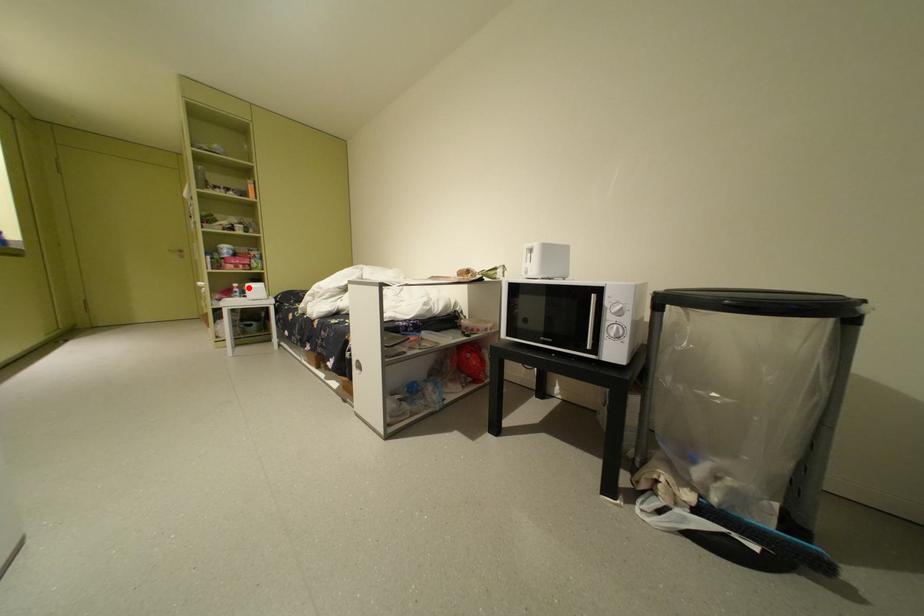
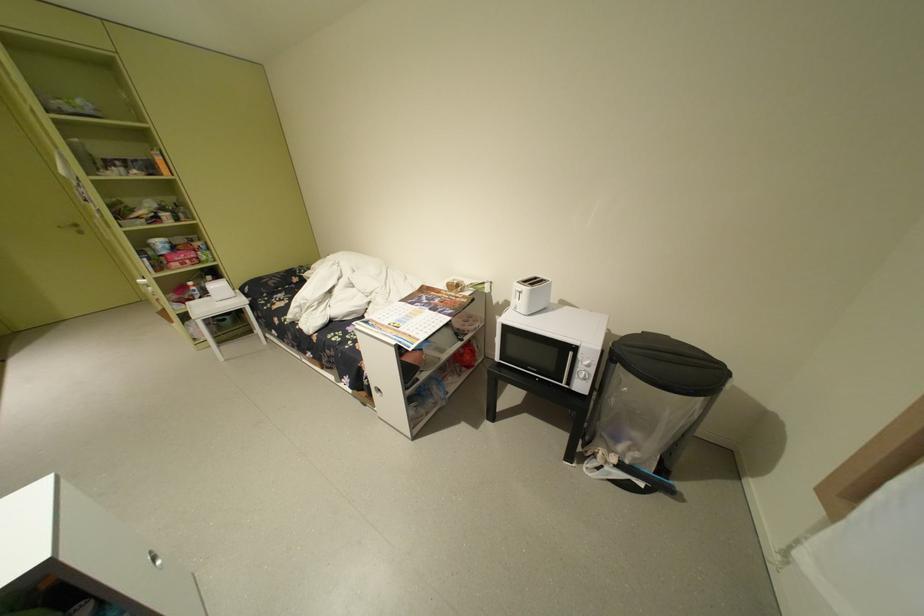
Find the pixel in the second image that matches the highlighted location in the first image.

(204, 286)